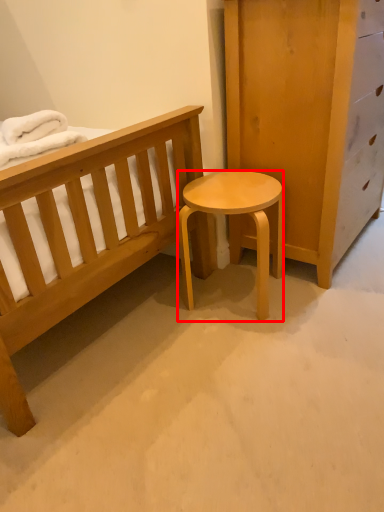
Question: From the image's perspective, where is stool (annotated by the red box) located relative to blanket?

Choices:
 (A) above
 (B) below

Answer: (B)